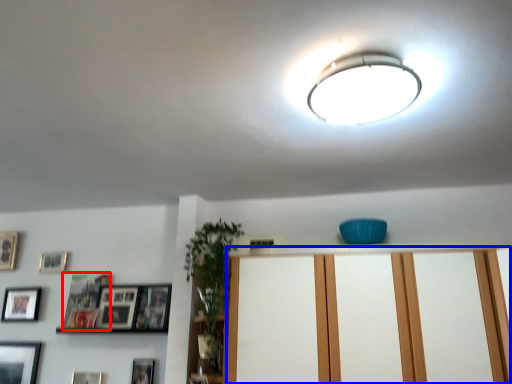
Question: Among these objects, which one is farthest to the camera, picture frame (highlighted by a red box) or dresser (highlighted by a blue box)?

Choices:
 (A) picture frame
 (B) dresser

Answer: (A)